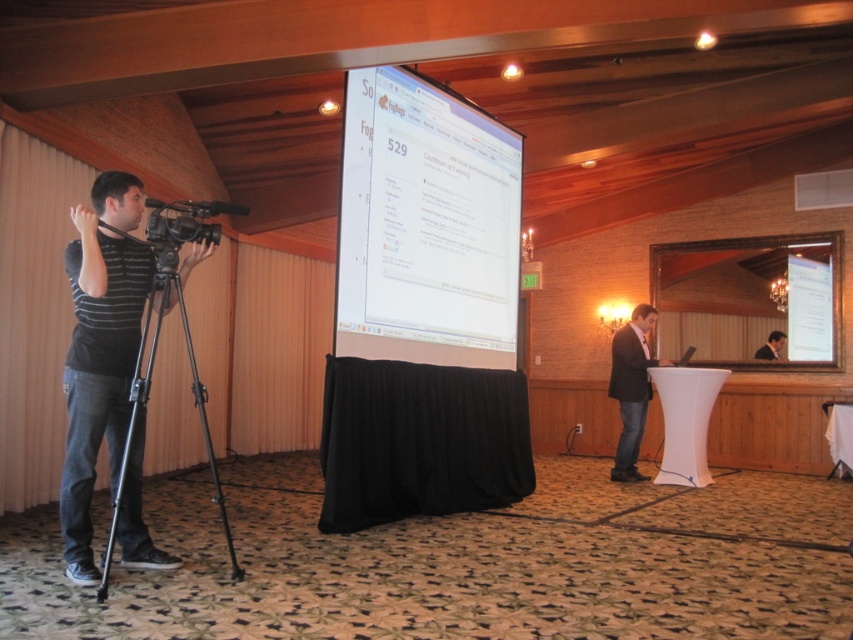
Question: Estimate the real-world distances between objects in this image. Which object is farther from the dark gray suit at center?

Choices:
 (A) white fabric podium at center
 (B) white glossy projection screen at center
 (C) black matte tripod at left

Answer: (C)

Question: Based on their relative distances, which object is farther from the black matte tripod at left?

Choices:
 (A) dark gray suit at center
 (B) white fabric podium at center
 (C) smooth skin face at center
 (D) white glossy projection screen at center

Answer: (C)

Question: Can you confirm if white glossy projection screen at center is wider than smooth skin face at center?

Choices:
 (A) no
 (B) yes

Answer: (B)

Question: Does white fabric podium at center come in front of dark gray suit at center?

Choices:
 (A) yes
 (B) no

Answer: (A)

Question: Which of the following is the closest to the observer?

Choices:
 (A) black matte tripod at left
 (B) white glossy projection screen at center
 (C) dark gray suit at center

Answer: (A)

Question: Is the position of black matte tripod at left more distant than that of white fabric podium at center?

Choices:
 (A) yes
 (B) no

Answer: (B)